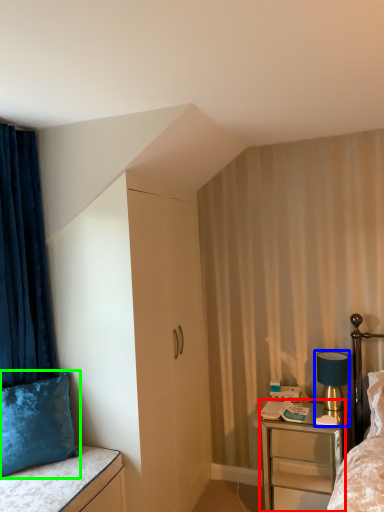
Question: Which object is positioned farthest from nightstand (highlighted by a red box)? Select from bedside lamp (highlighted by a blue box) and pillow (highlighted by a green box).

Choices:
 (A) bedside lamp
 (B) pillow

Answer: (B)